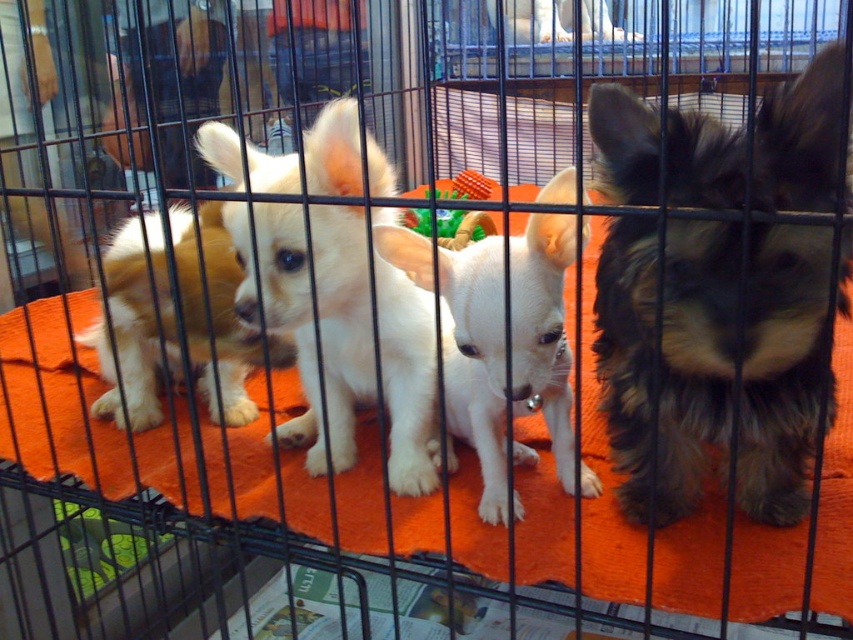
Looking at this image, you are a veterinarian examining the puppies in the cage. You need to reach the dark brown fur at right to check its health. Given that the cage is 1 meter wide and 0.8 meters tall, can you estimate how far horizontally and vertically from the bottom left corner of the cage you should move to reach the puppy?

The dark brown fur at right is located at coordinates point (712, 358). To reach it, move approximately 56.2 centimeters horizontally and 66.96 centimeters vertically from the bottom left corner of the cage.